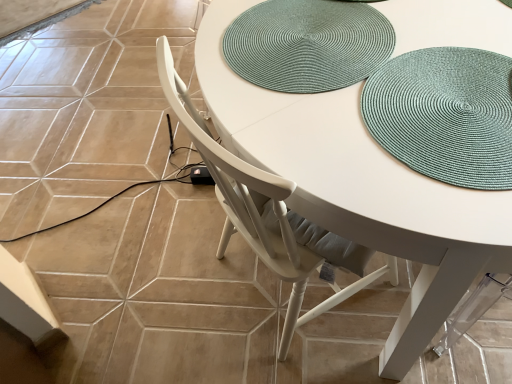
Question: Is teal woven placemat at upper center taller or shorter than teal woven placemat at upper right?

Choices:
 (A) tall
 (B) short

Answer: (B)

Question: In the image, is teal woven placemat at upper center positioned in front of or behind teal woven placemat at upper right?

Choices:
 (A) behind
 (B) front

Answer: (A)

Question: Which of these objects is positioned closest to the teal woven placemat at upper center?

Choices:
 (A) white wood chair at center
 (B) teal woven placemat at upper right

Answer: (B)

Question: Which object is the farthest from the teal woven placemat at upper center?

Choices:
 (A) white wood chair at center
 (B) teal woven placemat at upper right

Answer: (A)